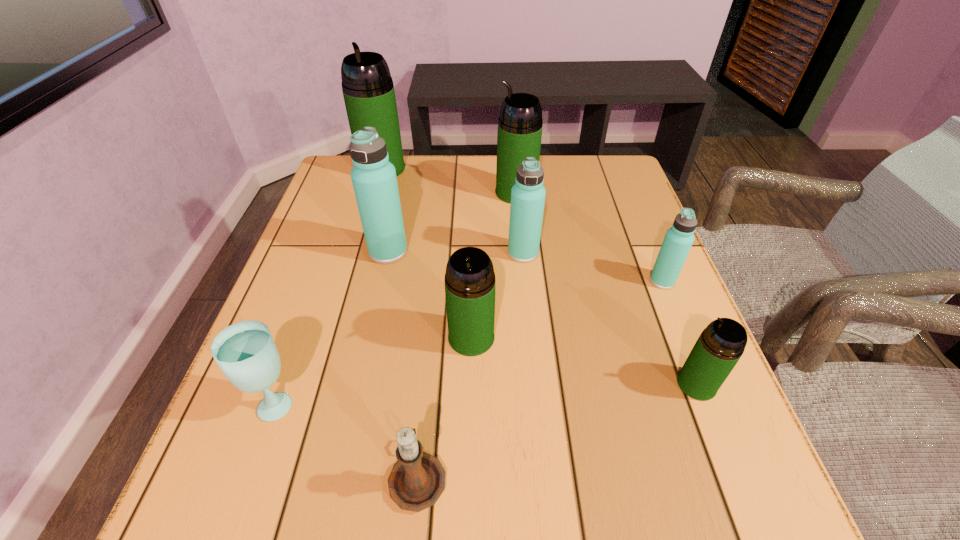
The image size is (960, 540). What are the coordinates of `empty space that is in between the smallest green thermos bottle and the second aqua thermos bottle from right to left` in the screenshot? It's located at (610, 319).

At what (x,y) coordinates should I click in order to perform the action: click on vacant space in between the candle holder and the smallest green thermos bottle. Please return your answer as a coordinate pair (x, y). Looking at the image, I should click on (557, 430).

Identify the location of unoccupied area between the tallest thermos bottle and the second smallest aqua thermos bottle. (452, 211).

I want to click on unoccupied area between the biggest aqua thermos bottle and the third thermos bottle from left to right, so click(x=430, y=294).

Identify which object is the fourth closest to the third green thermos bottle from left to right. Please provide its 2D coordinates. Your answer should be formatted as a tuple, i.e. [(x, y)], where the tuple contains the x and y coordinates of a point satisfying the conditions above.

[(678, 240)]

Point out which object is positioned as the second nearest to the second aqua thermos bottle from left to right. Please provide its 2D coordinates. Your answer should be formatted as a tuple, i.e. [(x, y)], where the tuple contains the x and y coordinates of a point satisfying the conditions above.

[(470, 283)]

Find the location of `the second closest thermos bottle relative to the fifth nearest object`. the second closest thermos bottle relative to the fifth nearest object is located at coordinates (528, 194).

What are the coordinates of `thermos bottle that is the sixth nearest to the second biggest aqua thermos bottle` in the screenshot? It's located at (367, 86).

This screenshot has width=960, height=540. I want to click on green thermos bottle that is the third nearest to the leftmost green thermos bottle, so click(721, 344).

Where is `green thermos bottle that is the closest to the nearest thermos bottle`? The height and width of the screenshot is (540, 960). green thermos bottle that is the closest to the nearest thermos bottle is located at coordinates (470, 283).